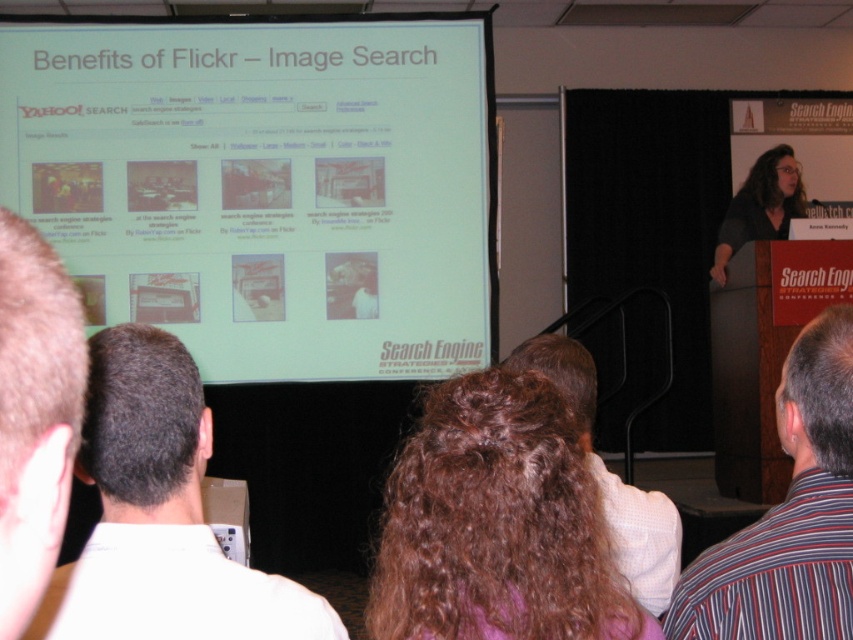
Question: Which object is farther from the camera taking this photo?

Choices:
 (A) white matte projection screen at upper center
 (B) white shirt at upper left
 (C) brown curly hair at lower center

Answer: (A)

Question: Does white shirt at upper left appear under brown curly hair at lower center?

Choices:
 (A) no
 (B) yes

Answer: (A)

Question: Is brown hair at left below matte black hair at right?

Choices:
 (A) no
 (B) yes

Answer: (B)

Question: Which point appears closest to the camera in this image?

Choices:
 (A) (778, 208)
 (B) (775, 609)
 (C) (364, 276)
 (D) (415, 477)

Answer: (D)

Question: Which point is farther to the camera?

Choices:
 (A) curly brown hair at center
 (B) matte black hair at right
 (C) brown hair at left

Answer: (B)

Question: Does white matte projection screen at upper center appear under brown hair at left?

Choices:
 (A) no
 (B) yes

Answer: (A)